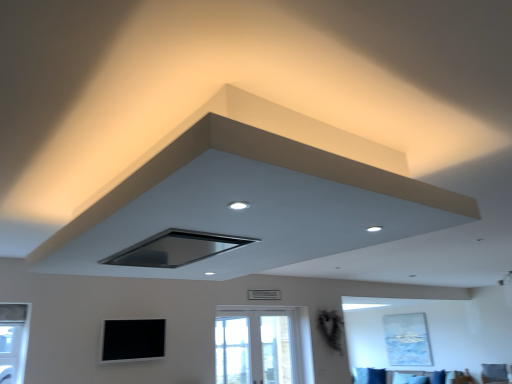
Identify the location of black matte window screen at lower center. The image size is (512, 384). (133, 340).

The width and height of the screenshot is (512, 384). What do you see at coordinates (262, 345) in the screenshot?
I see `white glass window at center` at bounding box center [262, 345].

I want to click on black matte exhaust hood at center, marked as the 2th exhaust hood in a right-to-left arrangement, so click(x=176, y=249).

The width and height of the screenshot is (512, 384). In order to click on velvet blue sofa at lower center in this screenshot , I will do pyautogui.click(x=372, y=374).

In the scene shown: Is black matte window screen at lower center inside or outside of matte black exhaust hood at upper center, which ranks as the second exhaust hood in left-to-right order?

black matte window screen at lower center lies outside matte black exhaust hood at upper center, which ranks as the second exhaust hood in left-to-right order.

Is black matte window screen at lower center looking in the opposite direction of matte black exhaust hood at upper center, marked as the 1th exhaust hood in a right-to-left arrangement?

No, black matte window screen at lower center is not facing away from matte black exhaust hood at upper center, marked as the 1th exhaust hood in a right-to-left arrangement.

Does point (150, 320) come behind point (388, 220)?

Yes, it is.

Is there a large distance between black matte window screen at lower center and matte black exhaust hood at upper center, which ranks as the second exhaust hood in left-to-right order?

Absolutely, black matte window screen at lower center is distant from matte black exhaust hood at upper center, which ranks as the second exhaust hood in left-to-right order.

Consider the image. From the image's perspective, which object appears higher, black matte window screen at lower center or velvet blue sofa at lower center?

black matte window screen at lower center.

Is black matte window screen at lower center positioned beyond the bounds of velvet blue sofa at lower center?

Absolutely, black matte window screen at lower center is external to velvet blue sofa at lower center.

Is black matte window screen at lower center oriented away from velvet blue sofa at lower center?

black matte window screen at lower center is not turned away from velvet blue sofa at lower center.

Considering the positions of objects velvet blue sofa at lower center and black matte window screen at lower center in the image provided, who is more to the left, velvet blue sofa at lower center or black matte window screen at lower center?

black matte window screen at lower center is more to the left.

Considering the relative sizes of velvet blue sofa at lower center and black matte window screen at lower center in the image provided, is velvet blue sofa at lower center taller than black matte window screen at lower center?

No, velvet blue sofa at lower center is not taller than black matte window screen at lower center.

Which is in front, velvet blue sofa at lower center or black matte window screen at lower center?

black matte window screen at lower center.

The width and height of the screenshot is (512, 384). In order to click on window screen above the velvet blue sofa at lower center (from the image's perspective) in this screenshot , I will do `click(133, 340)`.

How distant is white glass window at center from black matte window screen at lower center?

white glass window at center is 1.33 meters away from black matte window screen at lower center.

From the picture: From a real-world perspective, is white glass window at center on black matte window screen at lower center?

No, from a real-world perspective, white glass window at center is not on top of black matte window screen at lower center.

Considering the relative sizes of white glass window at center and black matte window screen at lower center in the image provided, is white glass window at center wider than black matte window screen at lower center?

No, white glass window at center is not wider than black matte window screen at lower center.

I want to click on window lying behind the black matte window screen at lower center, so click(262, 345).

From the image's perspective, which is below, velvet blue sofa at lower center or white glass window at center?

velvet blue sofa at lower center is shown below in the image.

Does point (457, 377) lie in front of point (257, 366)?

No, (457, 377) is further to viewer.

Measure the distance from velvet blue sofa at lower center to white glass window at center.

velvet blue sofa at lower center is 2.67 meters away from white glass window at center.

From the picture: Which object is further away from the camera taking this photo, velvet blue sofa at lower center or white glass window at center?

Positioned behind is velvet blue sofa at lower center.

From a real-world perspective, is black matte exhaust hood at center, positioned as the first exhaust hood in left-to-right order, physically below black matte window screen at lower center?

No, from a real-world perspective, black matte exhaust hood at center, positioned as the first exhaust hood in left-to-right order, is not beneath black matte window screen at lower center.

Is black matte exhaust hood at center, positioned as the first exhaust hood in left-to-right order, taller or shorter than black matte window screen at lower center?

In the image, black matte exhaust hood at center, positioned as the first exhaust hood in left-to-right order, appears to be shorter than black matte window screen at lower center.

From the image's perspective, which exhaust hood is the 1st one above the black matte window screen at lower center? Please provide its 2D coordinates.

[(176, 249)]

Does black matte exhaust hood at center, positioned as the first exhaust hood in left-to-right order, have a greater width compared to black matte window screen at lower center?

Yes, black matte exhaust hood at center, positioned as the first exhaust hood in left-to-right order, is wider than black matte window screen at lower center.

Can you confirm if white glass window at center is positioned to the left of velvet blue sofa at lower center?

Indeed, white glass window at center is positioned on the left side of velvet blue sofa at lower center.

Which object is closer to the camera taking this photo, white glass window at center or velvet blue sofa at lower center?

white glass window at center.

Is white glass window at center oriented towards velvet blue sofa at lower center?

No, white glass window at center is not turned towards velvet blue sofa at lower center.

Looking at this image, is white glass window at center shorter than velvet blue sofa at lower center?

In fact, white glass window at center may be taller than velvet blue sofa at lower center.

Where is `window screen below the matte black exhaust hood at upper center, marked as the 1th exhaust hood in a right-to-left arrangement (from the image's perspective)`? The height and width of the screenshot is (384, 512). window screen below the matte black exhaust hood at upper center, marked as the 1th exhaust hood in a right-to-left arrangement (from the image's perspective) is located at coordinates (133, 340).

There is a velvet blue sofa at lower center. Identify the location of window screen above it (from a real-world perspective). (133, 340).

Looking at the image, which one is located closer to white glass window at center, velvet blue sofa at lower center or black matte exhaust hood at center, positioned as the first exhaust hood in left-to-right order?

velvet blue sofa at lower center is positioned closer to the anchor white glass window at center.

Based on the photo, when comparing their distances from matte black exhaust hood at upper center, which ranks as the second exhaust hood in left-to-right order, does black matte window screen at lower center or gray metallic air conditioning unit at center seem further?

gray metallic air conditioning unit at center lies further to matte black exhaust hood at upper center, which ranks as the second exhaust hood in left-to-right order, than the other object.

Based on their spatial positions, is black matte exhaust hood at center, marked as the 2th exhaust hood in a right-to-left arrangement, or black matte window screen at lower center further from white glass window at center?

black matte exhaust hood at center, marked as the 2th exhaust hood in a right-to-left arrangement, is further to white glass window at center.

Based on their spatial positions, is white glass window at center or velvet blue sofa at lower center further from gray metallic air conditioning unit at center?

Among the two, velvet blue sofa at lower center is located further to gray metallic air conditioning unit at center.

From the image, which object appears to be farther from black matte window screen at lower center, white glass window at center or gray metallic air conditioning unit at center?

gray metallic air conditioning unit at center lies further to black matte window screen at lower center than the other object.

Based on their spatial positions, is velvet blue sofa at lower center or gray metallic air conditioning unit at center further from black matte exhaust hood at center, marked as the 2th exhaust hood in a right-to-left arrangement?

velvet blue sofa at lower center is further to black matte exhaust hood at center, marked as the 2th exhaust hood in a right-to-left arrangement.

Looking at this image, from the image, which object appears to be nearer to black matte exhaust hood at center, marked as the 2th exhaust hood in a right-to-left arrangement, black matte window screen at lower center or gray metallic air conditioning unit at center?

Among the two, black matte window screen at lower center is located nearer to black matte exhaust hood at center, marked as the 2th exhaust hood in a right-to-left arrangement.

Considering their positions, is black matte window screen at lower center positioned closer to gray metallic air conditioning unit at center than black matte exhaust hood at center, marked as the 2th exhaust hood in a right-to-left arrangement?

black matte window screen at lower center is closer to gray metallic air conditioning unit at center.

Image resolution: width=512 pixels, height=384 pixels. Find the location of `window screen between black matte exhaust hood at center, marked as the 2th exhaust hood in a right-to-left arrangement, and gray metallic air conditioning unit at center from front to back`. window screen between black matte exhaust hood at center, marked as the 2th exhaust hood in a right-to-left arrangement, and gray metallic air conditioning unit at center from front to back is located at coordinates (133, 340).

This screenshot has height=384, width=512. I want to click on exhaust hood between matte black exhaust hood at upper center, which ranks as the second exhaust hood in left-to-right order, and white glass window at center in the front-back direction, so click(176, 249).

Find the location of `air conditioning between black matte exhaust hood at center, positioned as the first exhaust hood in left-to-right order, and velvet blue sofa at lower center from front to back`. air conditioning between black matte exhaust hood at center, positioned as the first exhaust hood in left-to-right order, and velvet blue sofa at lower center from front to back is located at coordinates (263, 294).

Find the location of a particular element. The height and width of the screenshot is (384, 512). exhaust hood between matte black exhaust hood at upper center, which ranks as the second exhaust hood in left-to-right order, and black matte window screen at lower center from front to back is located at coordinates pos(176,249).